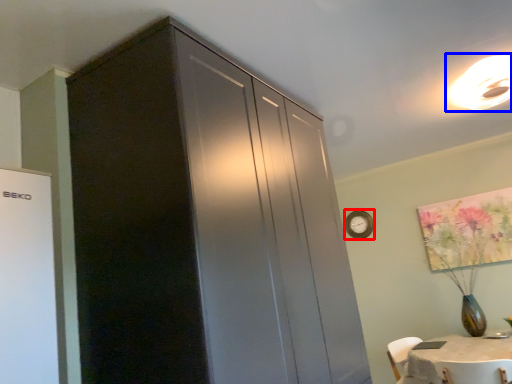
Question: Which object appears closest to the camera in this image, clock (highlighted by a red box) or light fixture (highlighted by a blue box)?

Choices:
 (A) clock
 (B) light fixture

Answer: (B)